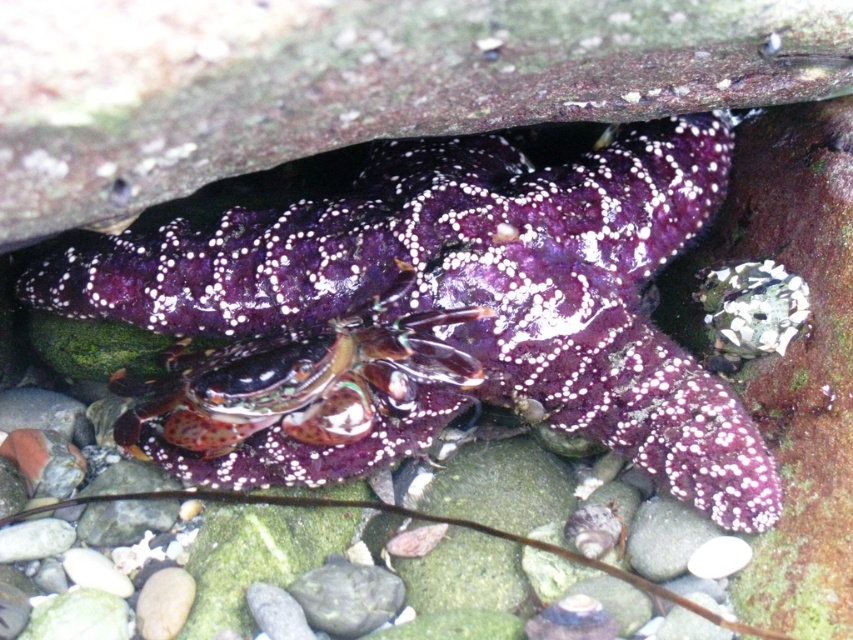
Is purple glossy starfish at center taller than shiny purple hermit crab at center?

Yes, purple glossy starfish at center is taller than shiny purple hermit crab at center.

Which is behind, point (196, 378) or point (309, 435)?

The point (196, 378) is more distant.

Between point (692, 493) and point (332, 452), which one is positioned in front?

Point (692, 493) is more forward.

Locate an element on the screen. Image resolution: width=853 pixels, height=640 pixels. purple glossy starfish at center is located at coordinates (444, 310).